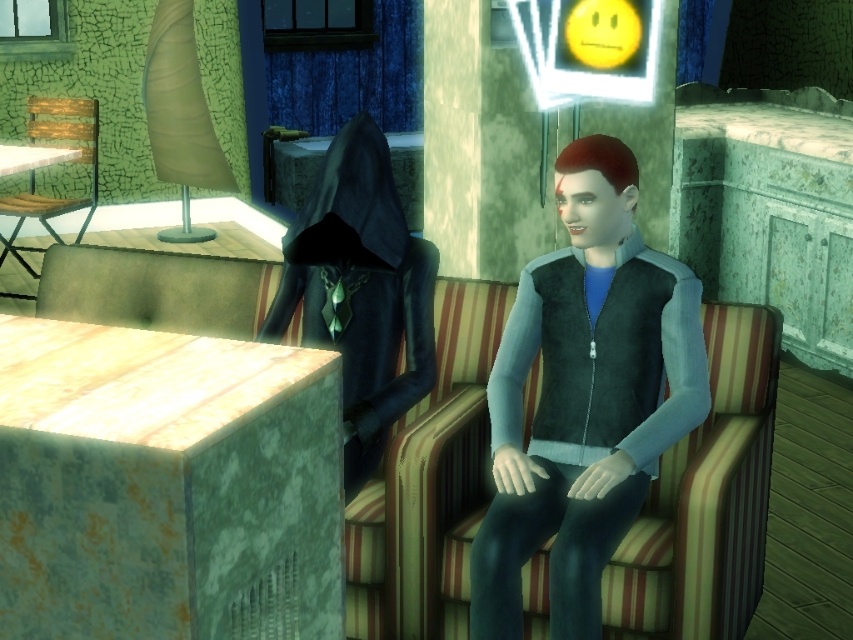
Question: Does matte brown cushion at left have a lesser width compared to wooden slats chair at left?

Choices:
 (A) yes
 (B) no

Answer: (B)

Question: Is smooth black vest at center above matte brown cushion at left?

Choices:
 (A) yes
 (B) no

Answer: (B)

Question: Estimate the real-world distances between objects in this image. Which object is farther from the matte black suit at center?

Choices:
 (A) striped fabric armchair at center
 (B) smooth black vest at center
 (C) matte brown cushion at left
 (D) wooden slats chair at left

Answer: (D)

Question: Which of these objects is positioned farthest from the matte brown cushion at left?

Choices:
 (A) matte black suit at center
 (B) wooden slats chair at left
 (C) striped fabric armchair at center
 (D) smooth black vest at center

Answer: (B)

Question: Can you confirm if matte black suit at center is positioned above striped fabric armchair at center?

Choices:
 (A) yes
 (B) no

Answer: (A)

Question: Which point appears farthest from the camera in this image?

Choices:
 (A) (459, 365)
 (B) (349, 467)

Answer: (A)